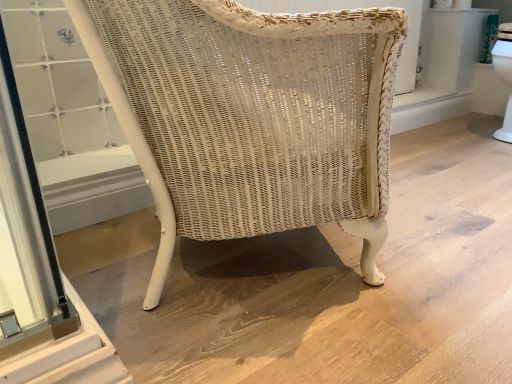
This screenshot has height=384, width=512. What do you see at coordinates (251, 115) in the screenshot? I see `white wicker chair at center` at bounding box center [251, 115].

Identify the location of white wicker chair at center. This screenshot has height=384, width=512. (251, 115).

Measure the distance between point (383,18) and camera.

Point (383,18) is 57.40 centimeters away from camera.

The image size is (512, 384). In order to click on metallic silver screen door at lower left in this screenshot , I will do `click(38, 273)`.

What do you see at coordinates (38, 273) in the screenshot? I see `metallic silver screen door at lower left` at bounding box center [38, 273].

I want to click on white wicker chair at center, so click(x=251, y=115).

Considering the relative positions of white wicker chair at center and metallic silver screen door at lower left in the image provided, is white wicker chair at center to the right of metallic silver screen door at lower left from the viewer's perspective?

Yes.

Which is behind, white wicker chair at center or metallic silver screen door at lower left?

metallic silver screen door at lower left is further away from the camera.

Which point is more forward, (294, 214) or (37, 236)?

The point (37, 236) is in front.

From the image's perspective, which is below, white wicker chair at center or metallic silver screen door at lower left?

metallic silver screen door at lower left, from the image's perspective.

Consider the image. From a real-world perspective, between white wicker chair at center and metallic silver screen door at lower left, who is vertically lower?

From a 3D spatial view, metallic silver screen door at lower left is below.

In terms of width, does white wicker chair at center look wider or thinner when compared to metallic silver screen door at lower left?

In the image, white wicker chair at center appears to be wider than metallic silver screen door at lower left.

From their relative heights in the image, would you say white wicker chair at center is taller or shorter than metallic silver screen door at lower left?

white wicker chair at center is taller than metallic silver screen door at lower left.

Does white wicker chair at center have a smaller size compared to metallic silver screen door at lower left?

No, white wicker chair at center is not smaller than metallic silver screen door at lower left.

Is white wicker chair at center outside of metallic silver screen door at lower left?

Yes, white wicker chair at center is outside of metallic silver screen door at lower left.

Is white wicker chair at center far from metallic silver screen door at lower left?

No.

Does white wicker chair at center turn towards metallic silver screen door at lower left?

No, white wicker chair at center is not turned towards metallic silver screen door at lower left.

How different are the orientations of white wicker chair at center and metallic silver screen door at lower left in degrees?

There is a 27-degree angle between the facing directions of white wicker chair at center and metallic silver screen door at lower left.

How distant is white wicker chair at center from metallic silver screen door at lower left?

The distance of white wicker chair at center from metallic silver screen door at lower left is 13.10 inches.

Locate an element on the screen. screen door located behind the white wicker chair at center is located at coordinates (38, 273).

Considering the relative positions of metallic silver screen door at lower left and white wicker chair at center in the image provided, is metallic silver screen door at lower left to the left or to the right of white wicker chair at center?

metallic silver screen door at lower left is to the left of white wicker chair at center.

Considering the positions of objects metallic silver screen door at lower left and white wicker chair at center in the image provided, who is behind, metallic silver screen door at lower left or white wicker chair at center?

metallic silver screen door at lower left.

Considering the points (34, 282) and (324, 191), which point is in front, point (34, 282) or point (324, 191)?

Point (34, 282)

From the image's perspective, is metallic silver screen door at lower left beneath white wicker chair at center?

Yes, from the image's perspective, metallic silver screen door at lower left is below white wicker chair at center.

From a real-world perspective, does metallic silver screen door at lower left sit lower than white wicker chair at center?

Yes.

Looking at this image, considering the sizes of metallic silver screen door at lower left and white wicker chair at center in the image, is metallic silver screen door at lower left wider or thinner than white wicker chair at center?

metallic silver screen door at lower left is thinner than white wicker chair at center.

Is metallic silver screen door at lower left taller than white wicker chair at center?

In fact, metallic silver screen door at lower left may be shorter than white wicker chair at center.

From the picture: Between metallic silver screen door at lower left and white wicker chair at center, which one has smaller size?

Smaller between the two is metallic silver screen door at lower left.

Would you say metallic silver screen door at lower left is inside or outside white wicker chair at center?

metallic silver screen door at lower left exists outside the volume of white wicker chair at center.

Is metallic silver screen door at lower left in contact with white wicker chair at center?

No, metallic silver screen door at lower left is not touching white wicker chair at center.

Is metallic silver screen door at lower left turned away from white wicker chair at center?

That's not correct — metallic silver screen door at lower left is not looking away from white wicker chair at center.

Based on the photo, how different are the orientations of metallic silver screen door at lower left and white wicker chair at center in degrees?

27 degrees separate the facing orientations of metallic silver screen door at lower left and white wicker chair at center.

Measure the distance between metallic silver screen door at lower left and white wicker chair at center.

metallic silver screen door at lower left and white wicker chair at center are 13.10 inches apart.

Identify the location of chair in front of the metallic silver screen door at lower left. This screenshot has width=512, height=384. (251, 115).

The height and width of the screenshot is (384, 512). I want to click on screen door that is on the left side of white wicker chair at center, so click(x=38, y=273).

This screenshot has width=512, height=384. I want to click on screen door below the white wicker chair at center (from the image's perspective), so click(x=38, y=273).